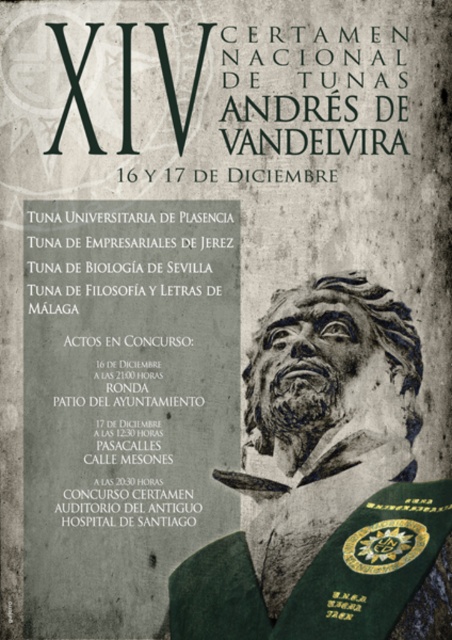
Who is more distant from viewer, (126, 412) or (286, 593)?

Point (126, 412)

Is black paper text at upper left wider than bronze statue at center?

Yes.

Which is in front, point (230, 216) or point (230, 612)?

Point (230, 216)

The height and width of the screenshot is (640, 452). Identify the location of black paper text at upper left. (130, 365).